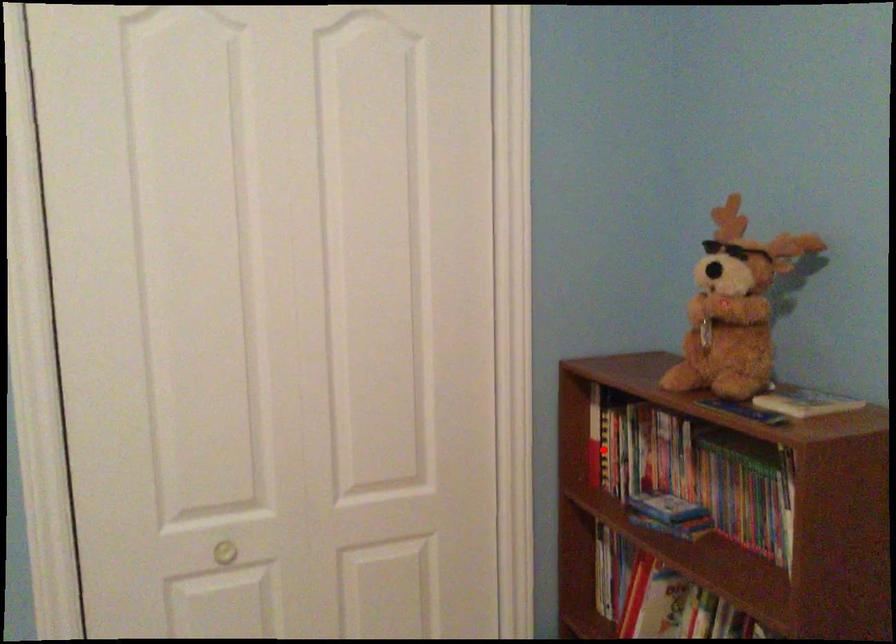
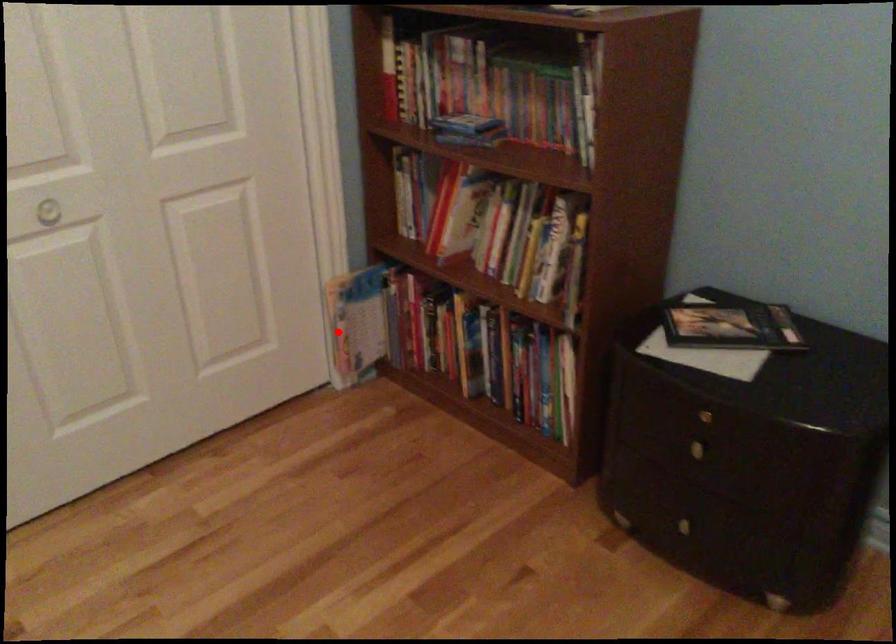
I am providing you with two images of the same scene from different viewpoints. A red point is marked on the first image and another point is marked on the second image. Is the red point in image1 aligned with the point shown in image2?

No